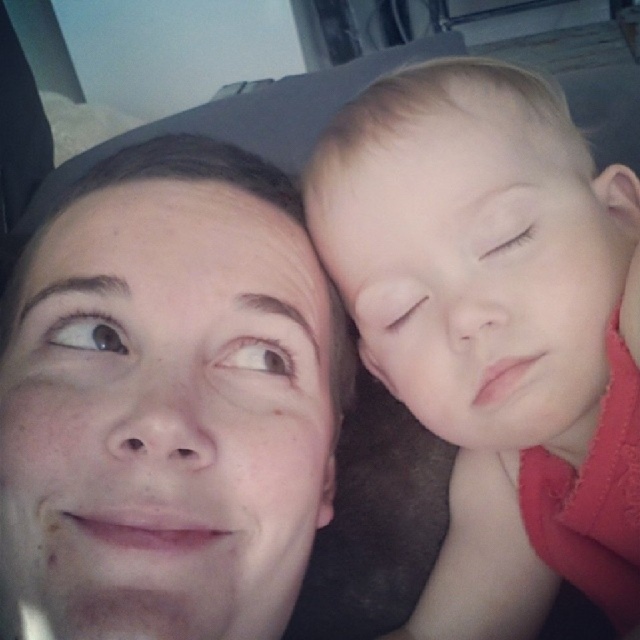
Question: Which of the following is the farthest from the observer?

Choices:
 (A) smooth skin baby at right
 (B) smooth skin face at upper left

Answer: (A)

Question: Is smooth skin face at upper left below smooth skin baby at right?

Choices:
 (A) yes
 (B) no

Answer: (B)

Question: Which of the following is the closest to the observer?

Choices:
 (A) (147, 396)
 (B) (554, 477)

Answer: (A)

Question: Does smooth skin face at upper left have a larger size compared to smooth skin baby at right?

Choices:
 (A) yes
 (B) no

Answer: (B)

Question: Can you confirm if smooth skin face at upper left is positioned to the right of smooth skin baby at right?

Choices:
 (A) yes
 (B) no

Answer: (B)